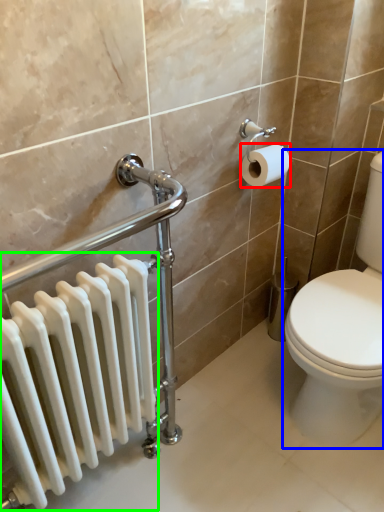
Question: Considering the real-world distances, which object is closest to toilet paper (highlighted by a red box)? toilet (highlighted by a blue box) or radiator (highlighted by a green box).

Choices:
 (A) toilet
 (B) radiator

Answer: (A)